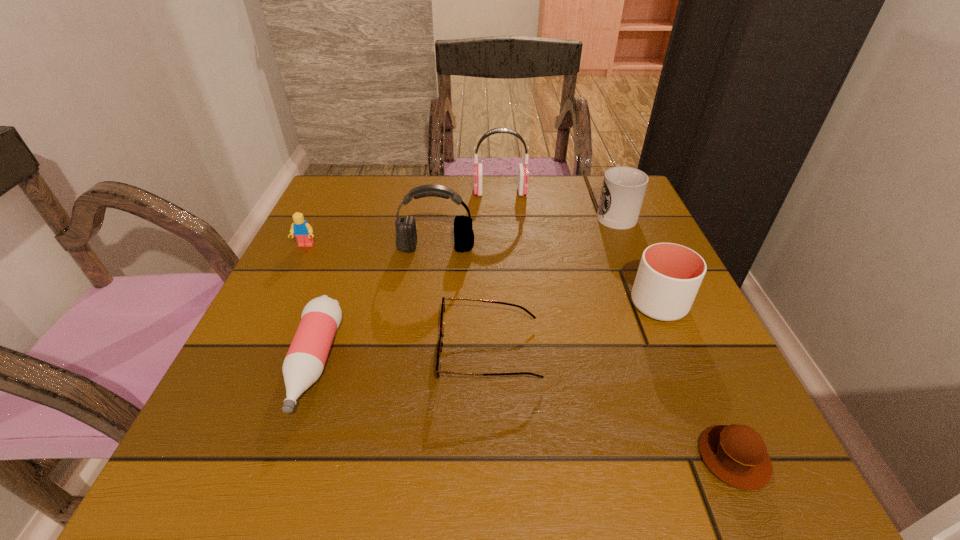
Where is `free space at the left edge of the desktop`? free space at the left edge of the desktop is located at coordinates pyautogui.click(x=310, y=289).

Identify the location of vacant region at the right edge of the desktop. Image resolution: width=960 pixels, height=540 pixels. (753, 417).

Identify the location of vacant region at the far left corner of the desktop. pyautogui.click(x=372, y=208).

This screenshot has width=960, height=540. In the image, there is a desktop. Identify the location of free space at the near left corner. (251, 492).

At what (x,y) coordinates should I click in order to perform the action: click on blank space at the far right corner of the desktop. Please return your answer as a coordinate pair (x, y). Looking at the image, I should click on (640, 222).

Locate an element on the screen. empty location between the nearer cup and the fifth tallest object is located at coordinates [482, 275].

The image size is (960, 540). I want to click on unoccupied area between the Lego and the spectacles, so click(398, 299).

The width and height of the screenshot is (960, 540). I want to click on vacant region between the nearer cup and the second object from left to right, so click(x=487, y=334).

Find the location of a particular element. free space between the nearer cup and the leftmost object is located at coordinates (482, 275).

Find the location of a particular element. blank region between the bottle and the farther cup is located at coordinates (465, 288).